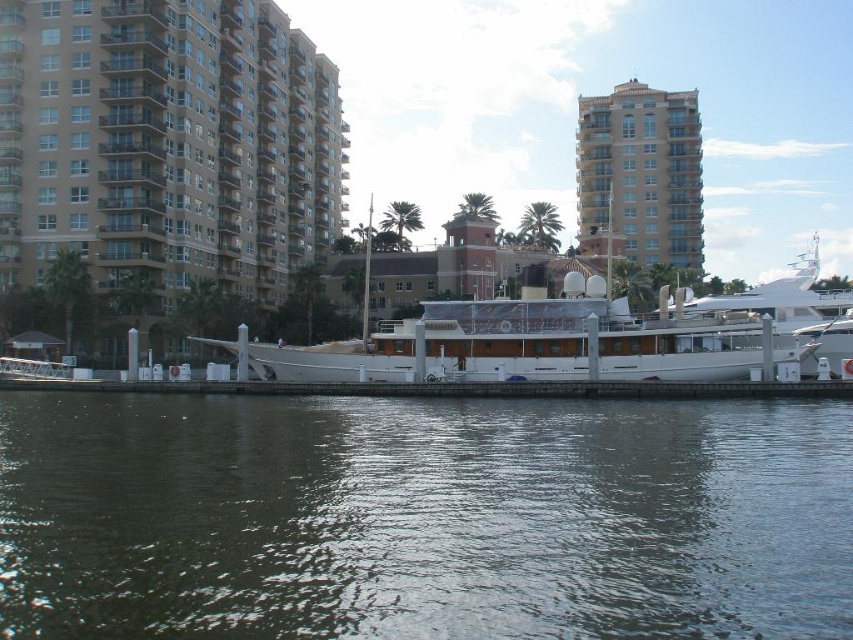
Based on the photo, based on the waterfront scene described, where is the beige concrete building at left located in the image? Please provide its coordinates.

The beige concrete building at left is located at coordinates point (167, 144).

You are a photographer planning to capture the white polished wood boat at center and the beige concrete building at left in the same frame. Which object should you focus on first if you want to ensure both are in focus without adjusting your camera settings?

The beige concrete building at left is smaller in size compared to the white polished wood boat at center, so you should focus on the larger object first to ensure both are in focus.